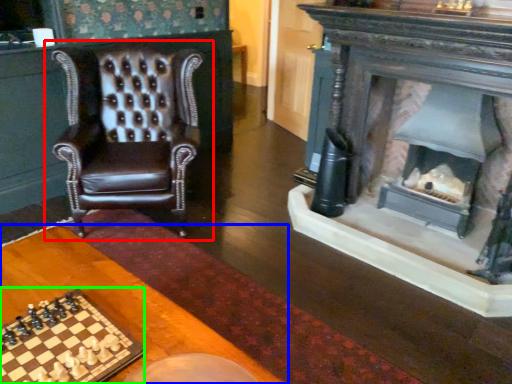
Question: Estimate the real-world distances between objects in this image. Which object is closer to chair (highlighted by a red box), table (highlighted by a blue box) or board game (highlighted by a green box)?

Choices:
 (A) table
 (B) board game

Answer: (A)